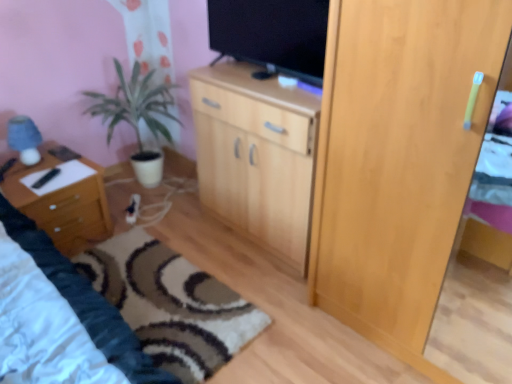
Question: Could you tell me if wooden nightstand at left is facing light wood cupboard at right?

Choices:
 (A) yes
 (B) no

Answer: (A)

Question: Does wooden nightstand at left have a lesser width compared to light wood cupboard at right?

Choices:
 (A) no
 (B) yes

Answer: (B)

Question: Is wooden nightstand at left facing away from light wood cupboard at right?

Choices:
 (A) yes
 (B) no

Answer: (B)

Question: Is wooden nightstand at left outside of light wood cupboard at right?

Choices:
 (A) yes
 (B) no

Answer: (A)

Question: Is the position of wooden nightstand at left more distant than that of light wood cupboard at right?

Choices:
 (A) yes
 (B) no

Answer: (A)

Question: Does wooden nightstand at left appear on the right side of light wood cupboard at right?

Choices:
 (A) no
 (B) yes

Answer: (A)

Question: From a real-world perspective, does wooden cabinet at center sit lower than wooden nightstand at left?

Choices:
 (A) no
 (B) yes

Answer: (A)

Question: Considering the relative sizes of wooden cabinet at center and wooden nightstand at left in the image provided, is wooden cabinet at center shorter than wooden nightstand at left?

Choices:
 (A) no
 (B) yes

Answer: (A)

Question: Can you confirm if wooden cabinet at center is wider than wooden nightstand at left?

Choices:
 (A) yes
 (B) no

Answer: (A)

Question: From a real-world perspective, is wooden cabinet at center positioned over wooden nightstand at left based on gravity?

Choices:
 (A) yes
 (B) no

Answer: (A)

Question: Would you say wooden cabinet at center is outside wooden nightstand at left?

Choices:
 (A) yes
 (B) no

Answer: (A)

Question: Is wooden cabinet at center smaller than wooden nightstand at left?

Choices:
 (A) yes
 (B) no

Answer: (B)

Question: From the image's perspective, is wooden cabinet at center on top of light wood cupboard at right?

Choices:
 (A) no
 (B) yes

Answer: (B)